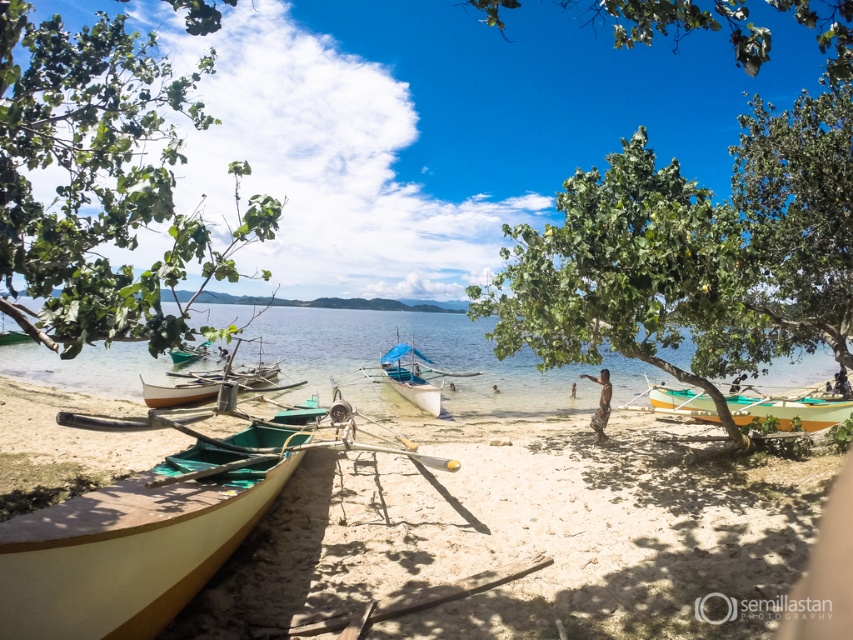
Is green leafy tree at left thinner than green matte boat at lower left?

In fact, green leafy tree at left might be wider than green matte boat at lower left.

Is green leafy tree at left positioned in front of green matte boat at lower left?

Yes, green leafy tree at left is in front of green matte boat at lower left.

The width and height of the screenshot is (853, 640). What are the coordinates of `green leafy tree at left` in the screenshot? It's located at (99, 180).

Looking at this image, is green leafy tree at upper center above white matte boat at center?

Yes, green leafy tree at upper center is above white matte boat at center.

Does green leafy tree at upper center appear on the right side of white matte boat at center?

Correct, you'll find green leafy tree at upper center to the right of white matte boat at center.

Is point (784, 0) closer to viewer compared to point (432, 390)?

Yes, point (784, 0) is in front of point (432, 390).

This screenshot has width=853, height=640. Identify the location of green leafy tree at upper center. (682, 24).

Can you confirm if wooden canoe at lower left is thinner than white matte boat at center?

In fact, wooden canoe at lower left might be wider than white matte boat at center.

Where is `wooden canoe at lower left`? This screenshot has width=853, height=640. wooden canoe at lower left is located at coordinates (527, 536).